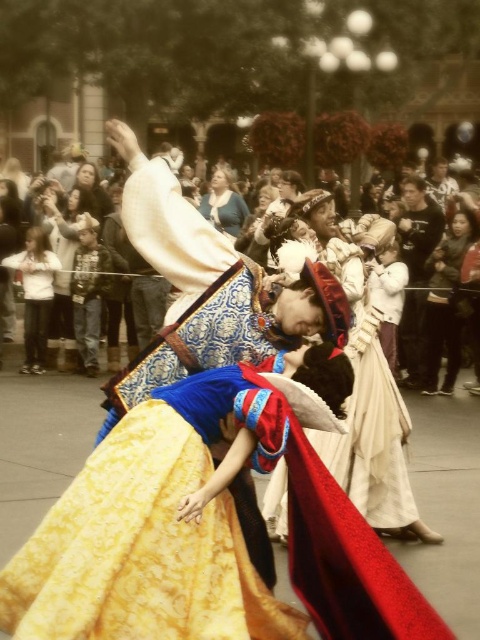
Is yellow satin dress at center shorter than black cotton shirt at right?

Yes.

Can you confirm if yellow satin dress at center is bigger than black cotton shirt at right?

Yes, yellow satin dress at center is bigger than black cotton shirt at right.

What do you see at coordinates (141, 548) in the screenshot? The image size is (480, 640). I see `yellow satin dress at center` at bounding box center [141, 548].

Where is `yellow satin dress at center`? Image resolution: width=480 pixels, height=640 pixels. yellow satin dress at center is located at coordinates (141, 548).

Can you confirm if matte black jacket at left is positioned to the right of matte blue dress at center?

In fact, matte black jacket at left is to the left of matte blue dress at center.

In the scene shown: How far apart are matte black jacket at left and matte blue dress at center?

matte black jacket at left is 21.78 meters from matte blue dress at center.

Image resolution: width=480 pixels, height=640 pixels. Identify the location of matte black jacket at left. (64, 272).

Does yellow satin dress at center appear over dark brown leather jacket at right?

Incorrect, yellow satin dress at center is not positioned above dark brown leather jacket at right.

Between yellow satin dress at center and dark brown leather jacket at right, which one appears on the left side from the viewer's perspective?

Positioned to the left is yellow satin dress at center.

You are a GUI agent. You are given a task and a screenshot of the screen. Output one action in this format:
    pyautogui.click(x=<x>, y=<y>)
    Task: Click on the yellow satin dress at center
    This screenshot has height=640, width=480.
    Given the screenshot: What is the action you would take?
    pyautogui.click(x=141, y=548)

Where is `yellow satin dress at center`? This screenshot has width=480, height=640. yellow satin dress at center is located at coordinates (141, 548).